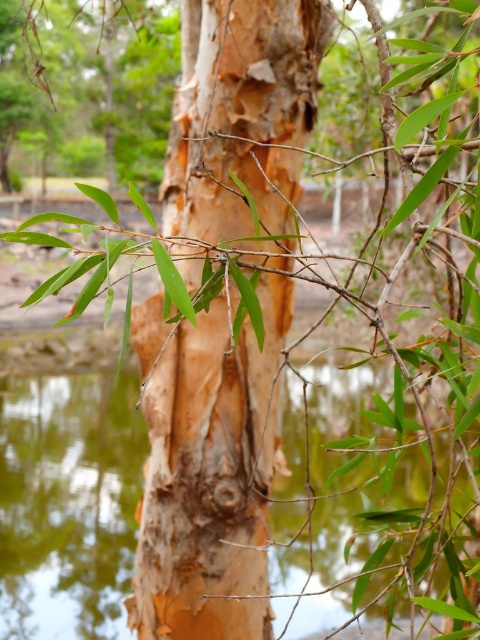
You are standing in front of the tree trunk and want to place a small birdhouse. The birdhouse needs to be placed above the green reflective water at center but below the smooth brown bark at center. Is this possible?

The smooth brown bark at center is located above the green reflective water at center, so there is no space between them to place the birdhouse. It is not possible.

You are standing in front of the tree trunk and want to touch the smooth brown bark at center. Based on the coordinates provided, can you estimate its position relative to the trunk?

The smooth brown bark at center is located at coordinates point (210, 477), which places it near the lower middle section of the trunk.

You are a painter standing in front of the tree trunk and the water. You want to paint both the smooth brown bark at center and the green reflective water at center. Which surface do you think will require more layers of paint to cover completely?

The smooth brown bark at center is thinner than the green reflective water at center, so the green reflective water at center will require more layers of paint to cover completely.